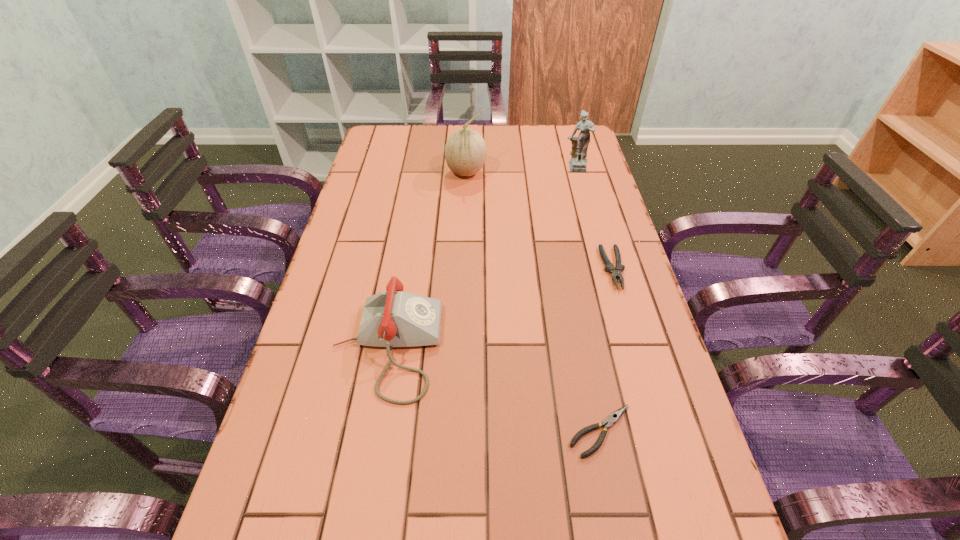
Find the location of a particular element. This screenshot has height=540, width=960. free point located at the gripping part of the taller pliers is located at coordinates [x=660, y=425].

Locate an element on the screen. The width and height of the screenshot is (960, 540). free space located on the left of the left pliers is located at coordinates (432, 431).

Find the location of a particular element. object that is at the left edge is located at coordinates (393, 318).

Where is `figurine situated at the right edge`? The width and height of the screenshot is (960, 540). figurine situated at the right edge is located at coordinates (578, 161).

What are the coordinates of `free region at the far edge of the desktop` in the screenshot? It's located at (508, 129).

This screenshot has width=960, height=540. What are the coordinates of `free spot at the left edge of the desktop` in the screenshot? It's located at coord(346,386).

The image size is (960, 540). I want to click on vacant region at the right edge of the desktop, so click(x=659, y=455).

Find the location of a particular element. This screenshot has height=540, width=960. free space at the far left corner of the desktop is located at coordinates (402, 154).

Identify the location of blank area at the far right corner. This screenshot has height=540, width=960. (553, 138).

Where is `free area in between the third tallest object and the figurine`? The image size is (960, 540). free area in between the third tallest object and the figurine is located at coordinates (481, 258).